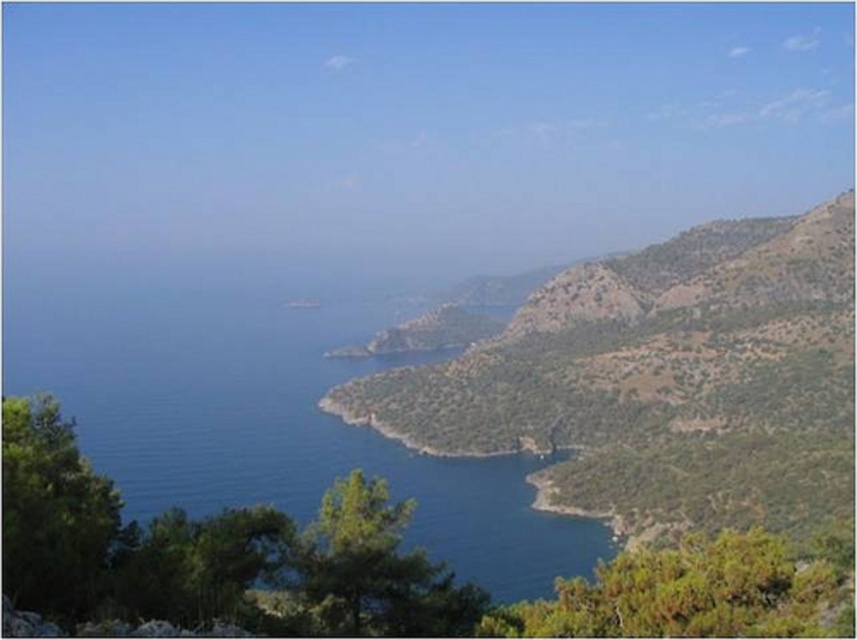
Which is behind, point (706, 470) or point (508, 474)?

Positioned behind is point (508, 474).

Does green textured mountain at center-right appear under blue water at center?

Yes, green textured mountain at center-right is below blue water at center.

Measure the distance between point (586, 483) and camera.

Point (586, 483) and camera are 191.59 meters apart.

The image size is (857, 640). What are the coordinates of `green textured mountain at center-right` in the screenshot? It's located at (661, 381).